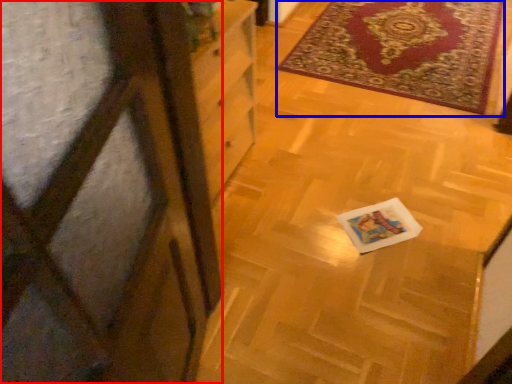
Question: Among these objects, which one is farthest to the camera, screen door (highlighted by a red box) or mat (highlighted by a blue box)?

Choices:
 (A) screen door
 (B) mat

Answer: (B)